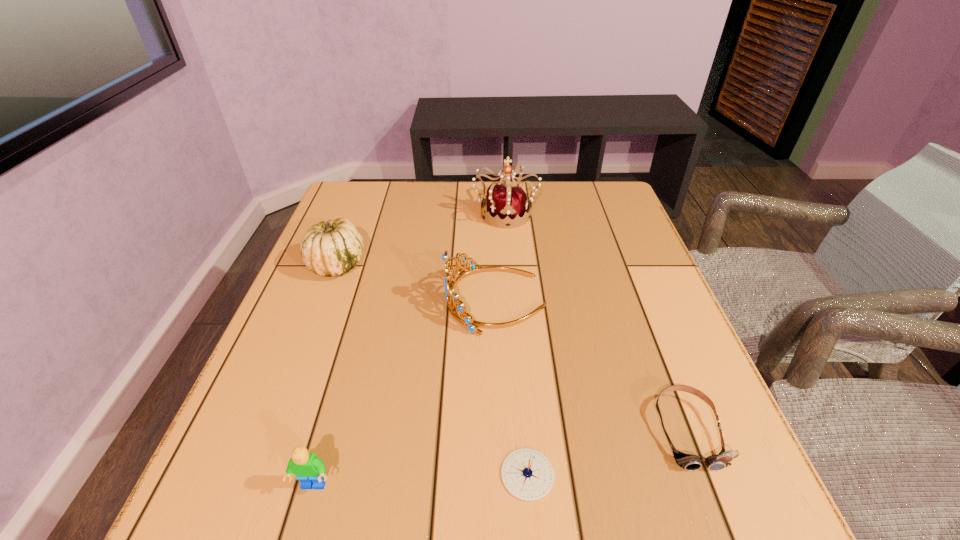
At what (x,y) coordinates should I click in order to perform the action: click on vacant space at the far edge of the desktop. Please return your answer as a coordinate pair (x, y). Looking at the image, I should click on (568, 210).

Locate an element on the screen. The height and width of the screenshot is (540, 960). free point at the near edge is located at coordinates (502, 496).

In the image, there is a desktop. Find the location of `vacant space at the left edge`. vacant space at the left edge is located at coordinates (230, 453).

Find the location of a particular element. This screenshot has width=960, height=540. vacant point at the near left corner is located at coordinates coord(277,488).

The height and width of the screenshot is (540, 960). What are the coordinates of `vacant space at the far right corner of the desktop` in the screenshot? It's located at (601, 185).

Locate an element on the screen. vacant space at the near right corner of the desktop is located at coordinates (679, 480).

At what (x,y) coordinates should I click in order to perform the action: click on free space between the rightmost object and the Lego. Please return your answer as a coordinate pair (x, y). This screenshot has height=540, width=960. Looking at the image, I should click on (500, 458).

This screenshot has width=960, height=540. I want to click on free space between the goggles and the gourd, so [512, 347].

Find the location of `free space between the Lego and the farthest object`. free space between the Lego and the farthest object is located at coordinates (410, 349).

Identify the location of free area in between the farthest object and the nearer tiara. The width and height of the screenshot is (960, 540). (500, 256).